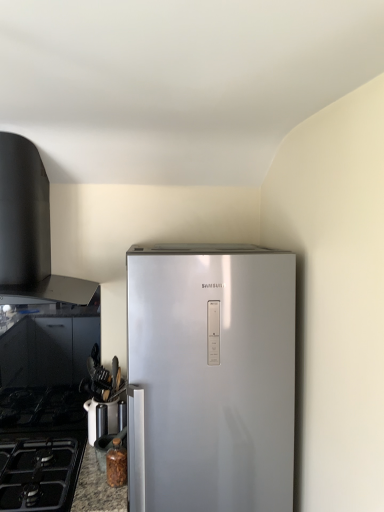
Question: Is the depth of granite countertop at lower left less than that of metallic silver knife block at lower left?

Choices:
 (A) yes
 (B) no

Answer: (A)

Question: From a real-world perspective, is granite countertop at lower left physically below metallic silver knife block at lower left?

Choices:
 (A) no
 (B) yes

Answer: (B)

Question: From a real-world perspective, is granite countertop at lower left on top of metallic silver knife block at lower left?

Choices:
 (A) yes
 (B) no

Answer: (B)

Question: Is granite countertop at lower left facing away from metallic silver knife block at lower left?

Choices:
 (A) yes
 (B) no

Answer: (B)

Question: From the image's perspective, is granite countertop at lower left above metallic silver knife block at lower left?

Choices:
 (A) yes
 (B) no

Answer: (B)

Question: From their relative heights in the image, would you say metallic silver knife block at lower left is taller or shorter than black matte gas stove at lower left?

Choices:
 (A) short
 (B) tall

Answer: (B)

Question: Is metallic silver knife block at lower left bigger or smaller than black matte gas stove at lower left?

Choices:
 (A) small
 (B) big

Answer: (A)

Question: Looking at their shapes, would you say metallic silver knife block at lower left is wider or thinner than black matte gas stove at lower left?

Choices:
 (A) wide
 (B) thin

Answer: (B)

Question: In the image, is metallic silver knife block at lower left positioned in front of or behind black matte gas stove at lower left?

Choices:
 (A) behind
 (B) front

Answer: (A)

Question: Considering the relative positions of black matte gas stove at lower left and granite countertop at lower left in the image provided, is black matte gas stove at lower left to the left or to the right of granite countertop at lower left?

Choices:
 (A) left
 (B) right

Answer: (A)

Question: From their relative heights in the image, would you say black matte gas stove at lower left is taller or shorter than granite countertop at lower left?

Choices:
 (A) short
 (B) tall

Answer: (A)

Question: From a real-world perspective, is black matte gas stove at lower left above or below granite countertop at lower left?

Choices:
 (A) below
 (B) above

Answer: (B)

Question: In terms of width, does black matte gas stove at lower left look wider or thinner when compared to granite countertop at lower left?

Choices:
 (A) thin
 (B) wide

Answer: (B)

Question: Is point (59, 443) positioned closer to the camera than point (36, 279)?

Choices:
 (A) closer
 (B) farther

Answer: (A)

Question: Relative to black matte vent at upper left, is black matte gas stove at lower left in front or behind?

Choices:
 (A) behind
 (B) front

Answer: (B)